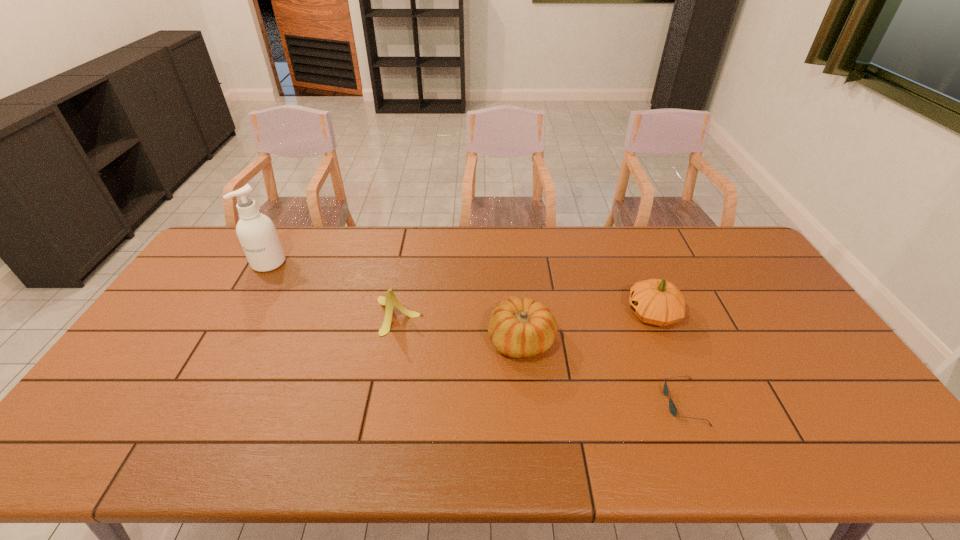
Where is `object that is the third closest to the right gourd`? The image size is (960, 540). object that is the third closest to the right gourd is located at coordinates (390, 300).

Select which object appears as the closest to the shortest object. Please provide its 2D coordinates. Your answer should be formatted as a tuple, i.e. [(x, y)], where the tuple contains the x and y coordinates of a point satisfying the conditions above.

[(659, 302)]

Image resolution: width=960 pixels, height=540 pixels. In order to click on free space that satisfies the following two spatial constraints: 1. on the front label of the farthest object; 2. on the right side of the banana in this screenshot , I will do `click(239, 315)`.

What are the coordinates of `vacant space that satisfies the following two spatial constraints: 1. on the front label of the cleansing agent; 2. on the right side of the second object from left to right` in the screenshot? It's located at (239, 315).